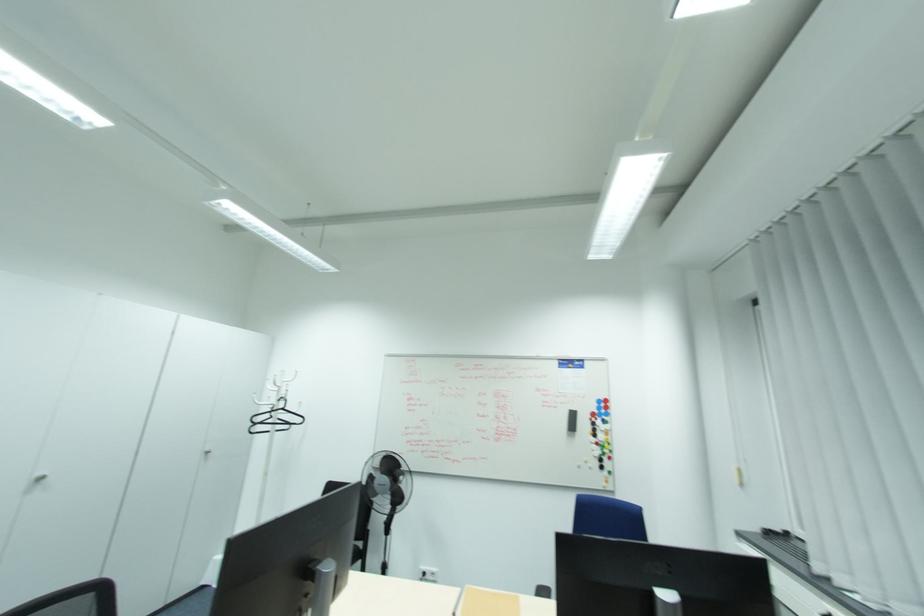
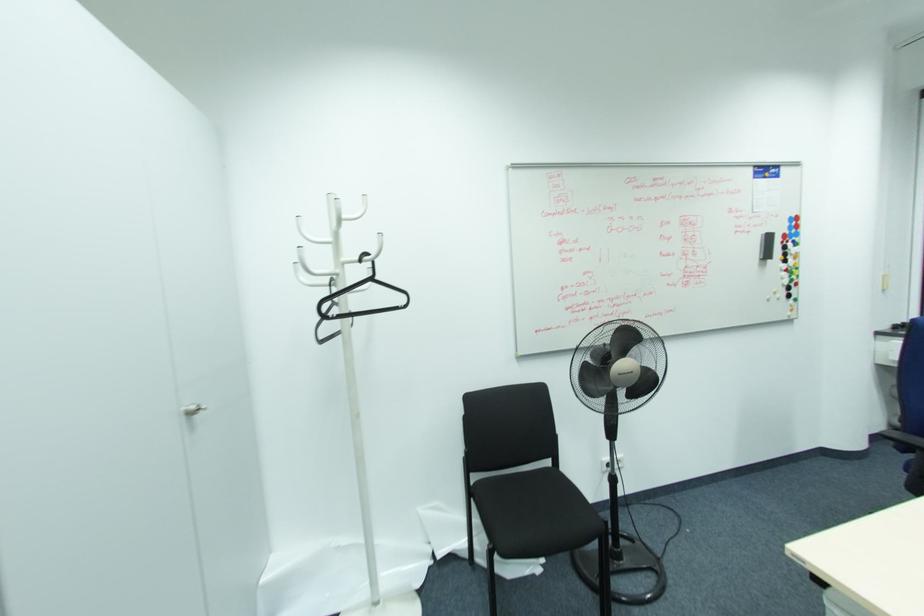
The point at (x=284, y=408) is marked in the first image. Where is the corresponding point in the second image?

(371, 280)